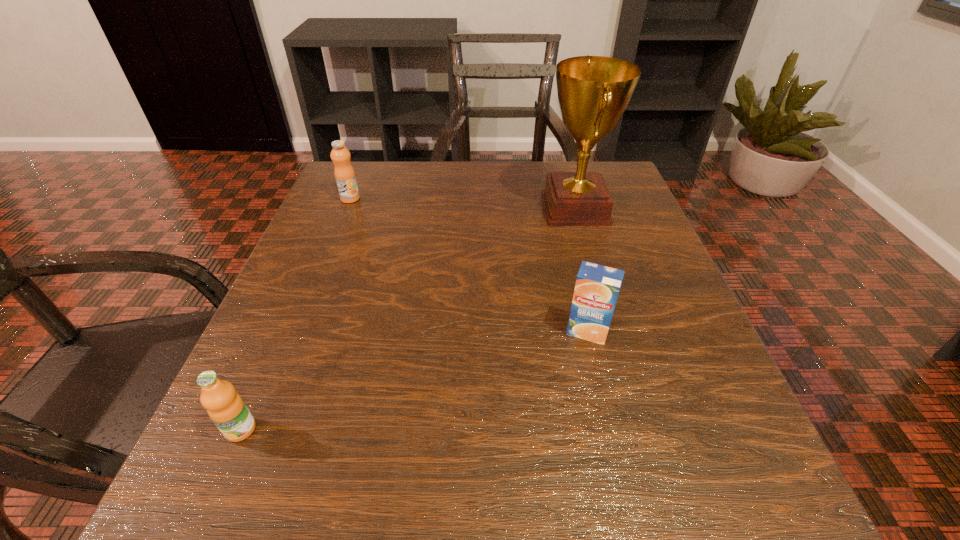
At what (x,y) coordinates should I click in order to perform the action: click on award. Please return your answer as a coordinate pair (x, y). This screenshot has height=540, width=960. Looking at the image, I should click on (593, 92).

Where is `the farthest orange juice`? The image size is (960, 540). the farthest orange juice is located at coordinates (344, 173).

Find the location of a particular element. The width and height of the screenshot is (960, 540). the second nearest object is located at coordinates (597, 286).

Where is `the rightmost orange juice`? the rightmost orange juice is located at coordinates (597, 286).

The image size is (960, 540). Identify the location of the nearest object. (226, 408).

Where is `free space located on the plaque of the tallest object`? Image resolution: width=960 pixels, height=540 pixels. free space located on the plaque of the tallest object is located at coordinates (371, 208).

I want to click on vacant space positioned 0.250m on the plaque of the tallest object, so click(x=429, y=208).

Locate an element on the screen. This screenshot has height=540, width=960. vacant space situated on the plaque of the tallest object is located at coordinates (379, 208).

Identify the location of vacant space located on the front label of the farthest orange juice. (341, 221).

This screenshot has height=540, width=960. Find the location of `vacant space located on the back of the second nearest object`. vacant space located on the back of the second nearest object is located at coordinates (563, 227).